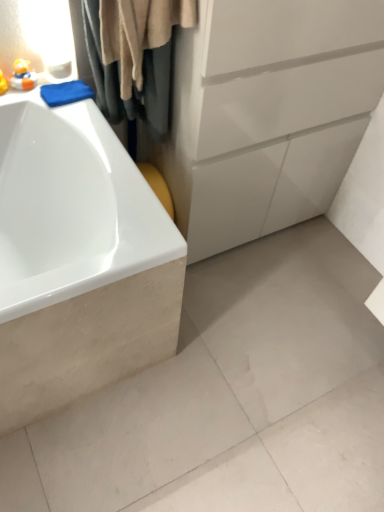
The width and height of the screenshot is (384, 512). What do you see at coordinates (22, 76) in the screenshot?
I see `matte yellow rubber duck at upper left, which is the second toy in left-to-right order` at bounding box center [22, 76].

How much space does matte yellow rubber duck at upper left, which is the second toy in left-to-right order, occupy vertically?

It is 2.68 inches.

At what (x,y) coordinates should I click in order to perform the action: click on matte yellow rubber duck at upper left, the first toy positioned from the left. Please return your answer as a coordinate pair (x, y). The height and width of the screenshot is (512, 384). Looking at the image, I should click on (3, 83).

Where is `beige fabric shower curtain at upper left`? The image size is (384, 512). beige fabric shower curtain at upper left is located at coordinates (134, 56).

This screenshot has width=384, height=512. What do you see at coordinates (78, 260) in the screenshot? I see `white glossy bathtub at left` at bounding box center [78, 260].

Locate an element on the screen. matte yellow rubber duck at upper left, which is the 1th toy from right to left is located at coordinates (22, 76).

Locate an element on the screen. the 2nd toy above when counting from the white matte concrete at lower left (from the image's perspective) is located at coordinates (22, 76).

Is matte yellow rubber duck at upper left, which is the second toy in left-to-right order, aimed at white matte concrete at lower left?

No, matte yellow rubber duck at upper left, which is the second toy in left-to-right order, is not turned towards white matte concrete at lower left.

Which is more distant, (21, 77) or (233, 392)?

The point (233, 392) is farther from the camera.

From the picture: Relative to beige fabric shower curtain at upper left, is white matte concrete at lower left in front or behind?

white matte concrete at lower left is behind beige fabric shower curtain at upper left.

From the picture: From the image's perspective, is white matte concrete at lower left located above or below beige fabric shower curtain at upper left?

Clearly, from the image's perspective, white matte concrete at lower left is below beige fabric shower curtain at upper left.

Is white matte concrete at lower left turned away from beige fabric shower curtain at upper left?

No, white matte concrete at lower left is not facing away from beige fabric shower curtain at upper left.

How different are the orientations of white matte concrete at lower left and beige fabric shower curtain at upper left in degrees?

179 degrees.

Which of these two, matte yellow rubber duck at upper left, the first toy positioned from the left, or white matte concrete at lower left, stands shorter?

white matte concrete at lower left.

Is matte yellow rubber duck at upper left, the first toy positioned from the left, completely or partially outside of white matte concrete at lower left?

Indeed, matte yellow rubber duck at upper left, the first toy positioned from the left, is completely outside white matte concrete at lower left.

Are matte yellow rubber duck at upper left, the first toy positioned from the left, and white matte concrete at lower left located far from each other?

That's right, there is a large distance between matte yellow rubber duck at upper left, the first toy positioned from the left, and white matte concrete at lower left.

Consider the image. Relative to matte yellow rubber duck at upper left, which is the 1th toy from right to left, is beige fabric shower curtain at upper left in front or behind?

Clearly, beige fabric shower curtain at upper left is in front of matte yellow rubber duck at upper left, which is the 1th toy from right to left.

Is point (103, 103) closer to camera compared to point (29, 85)?

Yes, point (103, 103) is in front of point (29, 85).

From a real-world perspective, is beige fabric shower curtain at upper left physically below matte yellow rubber duck at upper left, which is the second toy in left-to-right order?

Actually, beige fabric shower curtain at upper left is physically above matte yellow rubber duck at upper left, which is the second toy in left-to-right order, in the real world.

The height and width of the screenshot is (512, 384). In order to click on toy above the beige fabric shower curtain at upper left (from the image's perspective) in this screenshot , I will do `click(22, 76)`.

Is the position of white glossy bathtub at left less distant than that of matte yellow rubber duck at upper left, which is the second toy in left-to-right order?

That is True.

In terms of width, does white glossy bathtub at left look wider or thinner when compared to matte yellow rubber duck at upper left, which is the 1th toy from right to left?

In the image, white glossy bathtub at left appears to be wider than matte yellow rubber duck at upper left, which is the 1th toy from right to left.

From the picture: Which point is more forward, [70,296] or [17,72]?

The point [70,296] is closer to the camera.

Is white glossy bathtub at left not within matte yellow rubber duck at upper left, the first toy positioned from the left?

Yes, white glossy bathtub at left is outside of matte yellow rubber duck at upper left, the first toy positioned from the left.

Considering the points (131, 273) and (3, 88), which point is in front, point (131, 273) or point (3, 88)?

The point (131, 273) is in front.

Is white glossy bathtub at left in front of or behind matte yellow rubber duck at upper left, the first toy positioned from the left, in the image?

Visually, white glossy bathtub at left is located in front of matte yellow rubber duck at upper left, the first toy positioned from the left.

Does white glossy bathtub at left have a lesser width compared to matte yellow rubber duck at upper left, the first toy positioned from the left?

Incorrect, the width of white glossy bathtub at left is not less than that of matte yellow rubber duck at upper left, the first toy positioned from the left.

Looking at this image, would you say matte yellow rubber duck at upper left, positioned as the second toy in right-to-left order, is outside matte yellow rubber duck at upper left, which is the 1th toy from right to left?

Indeed, matte yellow rubber duck at upper left, positioned as the second toy in right-to-left order, is completely outside matte yellow rubber duck at upper left, which is the 1th toy from right to left.

Which of these two, matte yellow rubber duck at upper left, the first toy positioned from the left, or matte yellow rubber duck at upper left, which is the second toy in left-to-right order, stands shorter?

With less height is matte yellow rubber duck at upper left, which is the second toy in left-to-right order.

Can you confirm if matte yellow rubber duck at upper left, the first toy positioned from the left, is positioned to the right of matte yellow rubber duck at upper left, which is the 1th toy from right to left?

No, matte yellow rubber duck at upper left, the first toy positioned from the left, is not to the right of matte yellow rubber duck at upper left, which is the 1th toy from right to left.

Considering their positions, is matte yellow rubber duck at upper left, positioned as the second toy in right-to-left order, located in front of or behind matte yellow rubber duck at upper left, which is the second toy in left-to-right order?

In the image, matte yellow rubber duck at upper left, positioned as the second toy in right-to-left order, appears in front of matte yellow rubber duck at upper left, which is the second toy in left-to-right order.

At what (x,y) coordinates should I click in order to perform the action: click on the 2nd toy positioned above the white matte concrete at lower left (from the image's perspective). Please return your answer as a coordinate pair (x, y). The image size is (384, 512). Looking at the image, I should click on (22, 76).

You are a GUI agent. You are given a task and a screenshot of the screen. Output one action in this format:
    pyautogui.click(x=<x>, y=<y>)
    Task: Click on the concrete below the beige fabric shower curtain at upper left (from the image's perspective)
    The image size is (384, 512).
    Given the screenshot: What is the action you would take?
    pyautogui.click(x=232, y=397)

Estimate the real-world distances between objects in this image. Which object is further from beige fabric shower curtain at upper left, white glossy bathtub at left or matte yellow rubber duck at upper left, the first toy positioned from the left?

matte yellow rubber duck at upper left, the first toy positioned from the left.

Considering their positions, is matte yellow rubber duck at upper left, positioned as the second toy in right-to-left order, positioned closer to white matte concrete at lower left than beige fabric shower curtain at upper left?

beige fabric shower curtain at upper left is closer to white matte concrete at lower left.

Based on the photo, based on their spatial positions, is beige fabric shower curtain at upper left or matte yellow rubber duck at upper left, the first toy positioned from the left, further from matte yellow rubber duck at upper left, which is the 1th toy from right to left?

Based on the image, beige fabric shower curtain at upper left appears to be further to matte yellow rubber duck at upper left, which is the 1th toy from right to left.

Looking at the image, which one is located closer to white glossy bathtub at left, beige fabric shower curtain at upper left or matte yellow rubber duck at upper left, which is the second toy in left-to-right order?

The object closer to white glossy bathtub at left is beige fabric shower curtain at upper left.

Which object lies nearer to the anchor point beige fabric shower curtain at upper left, matte yellow rubber duck at upper left, which is the 1th toy from right to left, or white matte concrete at lower left?

matte yellow rubber duck at upper left, which is the 1th toy from right to left.

Which object lies nearer to the anchor point matte yellow rubber duck at upper left, which is the 1th toy from right to left, white matte concrete at lower left or white glossy bathtub at left?

Among the two, white glossy bathtub at left is located nearer to matte yellow rubber duck at upper left, which is the 1th toy from right to left.

Considering their positions, is matte yellow rubber duck at upper left, which is the second toy in left-to-right order, positioned closer to white matte concrete at lower left than white glossy bathtub at left?

white glossy bathtub at left is positioned closer to the anchor white matte concrete at lower left.

Estimate the real-world distances between objects in this image. Which object is closer to white matte concrete at lower left, white glossy bathtub at left or matte yellow rubber duck at upper left, positioned as the second toy in right-to-left order?

white glossy bathtub at left lies closer to white matte concrete at lower left than the other object.

What are the coordinates of `toy between matte yellow rubber duck at upper left, which is the 1th toy from right to left, and white glossy bathtub at left in the up-down direction` in the screenshot? It's located at (3, 83).

The image size is (384, 512). In order to click on shower curtain between matte yellow rubber duck at upper left, which is the second toy in left-to-right order, and white matte concrete at lower left, in the vertical direction in this screenshot , I will do `click(134, 56)`.

The image size is (384, 512). What are the coordinates of `toy between beige fabric shower curtain at upper left and white matte concrete at lower left in the up-down direction` in the screenshot? It's located at (3, 83).

The width and height of the screenshot is (384, 512). I want to click on bathtub between matte yellow rubber duck at upper left, positioned as the second toy in right-to-left order, and white matte concrete at lower left, in the vertical direction, so click(78, 260).